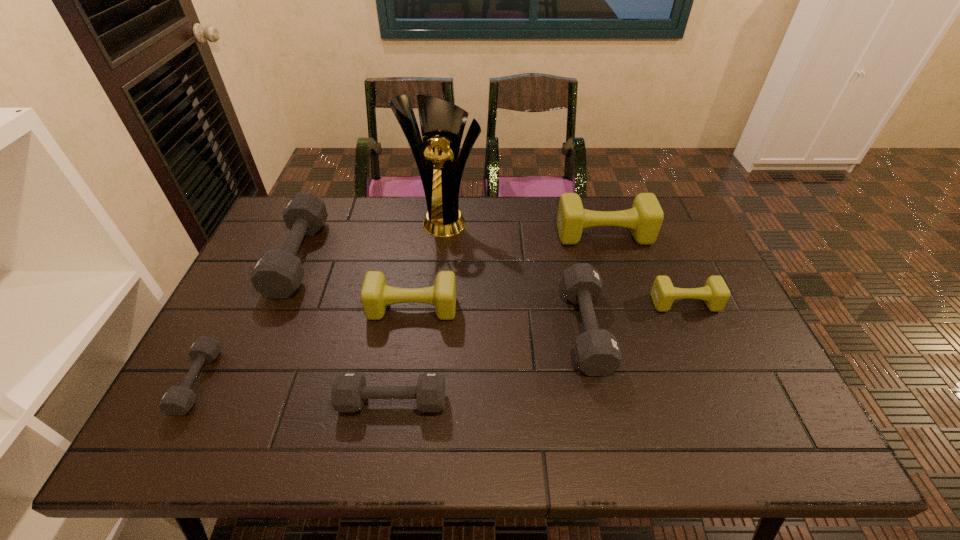
The width and height of the screenshot is (960, 540). Find the location of `the tallest object`. the tallest object is located at coordinates (442, 123).

This screenshot has height=540, width=960. What are the coordinates of `black award` in the screenshot? It's located at (442, 123).

Find the location of `the farthest olive dumbbell`. the farthest olive dumbbell is located at coordinates (645, 218).

This screenshot has width=960, height=540. Find the location of `the third gray dumbbell from right to left`. the third gray dumbbell from right to left is located at coordinates (278, 273).

You are a GUI agent. You are given a task and a screenshot of the screen. Output one action in this format:
    pyautogui.click(x=<x>, y=<y>)
    Task: Click on the biggest gray dumbbell
    This screenshot has width=960, height=540.
    Given the screenshot: What is the action you would take?
    pyautogui.click(x=278, y=273)

Where is `the leftmost olive dumbbell`? This screenshot has width=960, height=540. the leftmost olive dumbbell is located at coordinates (376, 295).

I want to click on the second biggest gray dumbbell, so click(x=597, y=353).

This screenshot has width=960, height=540. I want to click on the third biggest gray dumbbell, so click(x=349, y=391).

Image resolution: width=960 pixels, height=540 pixels. I want to click on the smallest olive dumbbell, so click(x=715, y=293).

At what (x,y) coordinates should I click in order to perform the action: click on the leftmost gray dumbbell. Please return your answer as a coordinate pair (x, y). Image resolution: width=960 pixels, height=540 pixels. Looking at the image, I should click on (177, 400).